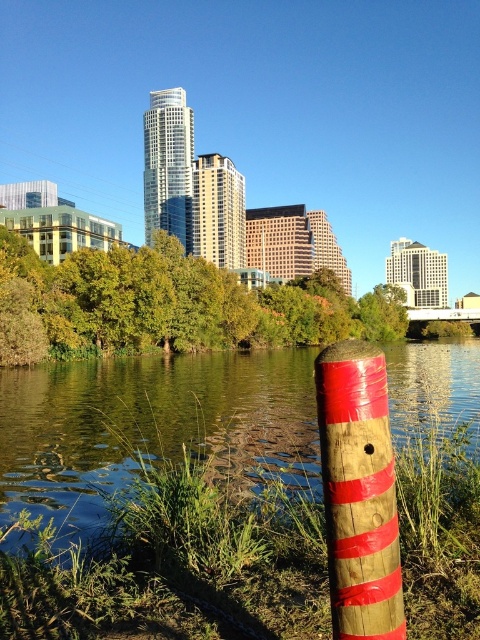
You are standing at the wooden post wrapped with red tape in the grassy area near the water edge. Looking towards the point marked at coordinates [151,426], what do you see there?

You see green grass at lower left at the coordinates [151,426].